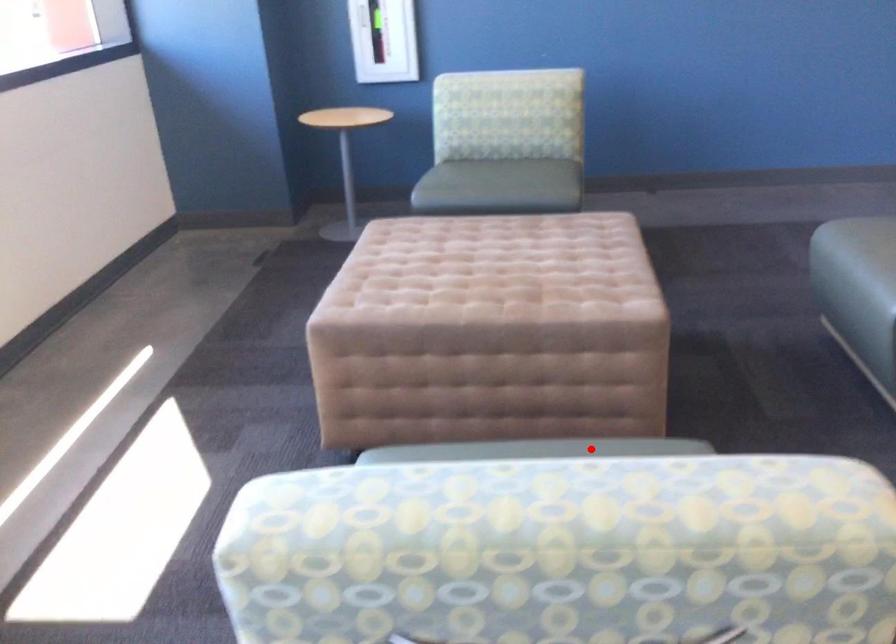
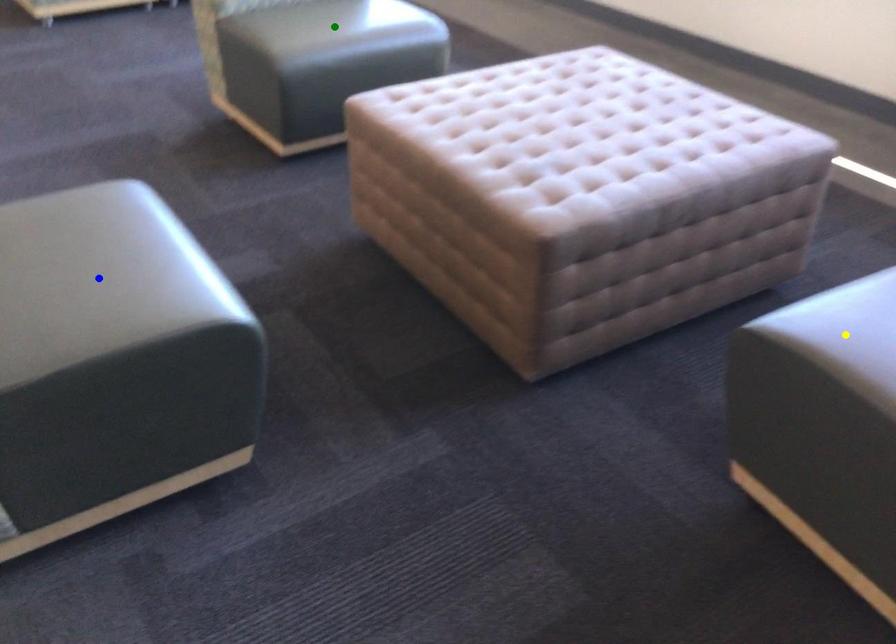
Question: I am providing you with two images of the same scene from different viewpoints. A red point is marked on the first image. You are given multiple points on the second image. Which point in image 2 represents the same 3d spot as the red point in image 1?

Choices:
 (A) blue point
 (B) yellow point
 (C) green point

Answer: (C)